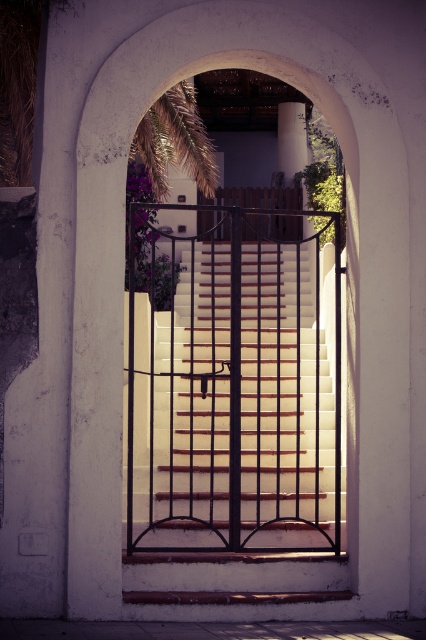
You are standing at the entrance of the house and see two points marked on the ground. One is at coordinate point (230, 509) and the other at point (152, 173). If you want to walk towards the closed black metal gate that flanks the stairs, which point should you step on first?

You should step on point (230, 509) first because it is in front of point (152, 173), meaning it is closer to the closed black metal gate that flanks the stairs.

You are standing at the entrance and want to reach the upper area. The wooden stairs at center and the white concrete pillar at upper center are in your way. Which object is closer to your right side?

The white concrete pillar at upper center is on the right side because the wooden stairs at center are positioned to the left of it.